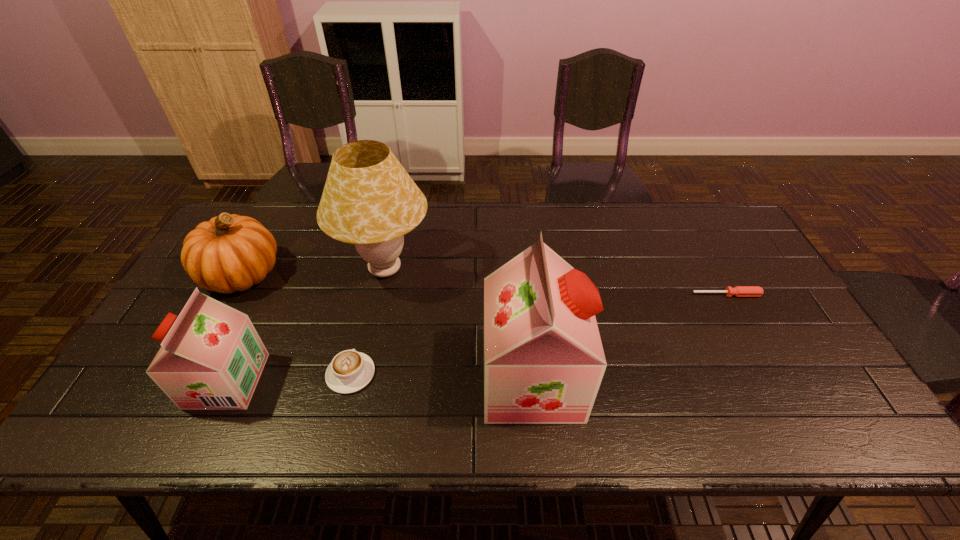
Where is `object positioned at the left edge`? The width and height of the screenshot is (960, 540). object positioned at the left edge is located at coordinates (229, 253).

Where is `object at the right edge`? object at the right edge is located at coordinates (739, 291).

Image resolution: width=960 pixels, height=540 pixels. I want to click on free space at the far edge of the desktop, so click(612, 224).

Where is `vacant space at the right edge`? vacant space at the right edge is located at coordinates (778, 294).

Find the location of a particular element. vacant position at the far left corner of the desktop is located at coordinates (250, 208).

The width and height of the screenshot is (960, 540). I want to click on free space at the far right corner of the desktop, so click(707, 226).

In the image, there is a desktop. Find the location of `free space at the near right corner`. free space at the near right corner is located at coordinates (823, 370).

The width and height of the screenshot is (960, 540). I want to click on free spot between the second shortest object and the pumpkin, so click(x=297, y=324).

Locate an element on the screen. Image resolution: width=960 pixels, height=540 pixels. vacant space that is in between the cappuccino and the left soya milk is located at coordinates (289, 377).

I want to click on vacant area that lies between the shortest object and the fifth object from left to right, so pos(629,337).